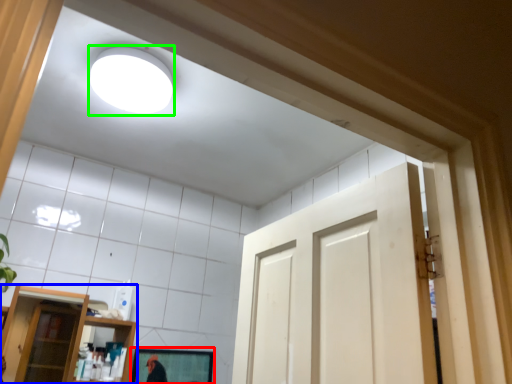
Question: Which object is positioned closest to mirror (highlighted by a red box)? Select from shelf (highlighted by a blue box) and lighting (highlighted by a green box).

Choices:
 (A) shelf
 (B) lighting

Answer: (B)